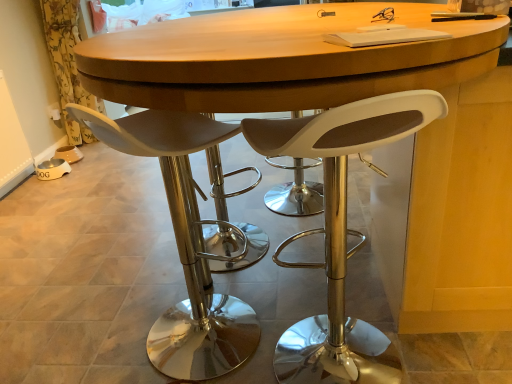
Question: From the image's perspective, is white matte stool at center, acting as the second chair starting from the right, positioned above or below white matte stool at center, which is the second chair from left to right?

Choices:
 (A) below
 (B) above

Answer: (B)

Question: In terms of height, does white matte stool at center, acting as the second chair starting from the right, look taller or shorter compared to white matte stool at center, which is the first chair from right to left?

Choices:
 (A) short
 (B) tall

Answer: (A)

Question: Based on their relative distances, which object is nearer to the yellow floral fabric at left?

Choices:
 (A) white matte stool at center, which is the second chair from left to right
 (B) white matte stool at center, arranged as the first chair when viewed from the left

Answer: (B)

Question: Estimate the real-world distances between objects in this image. Which object is farther from the white matte stool at center, which is the second chair from left to right?

Choices:
 (A) white matte stool at center, arranged as the first chair when viewed from the left
 (B) yellow floral fabric at left

Answer: (B)